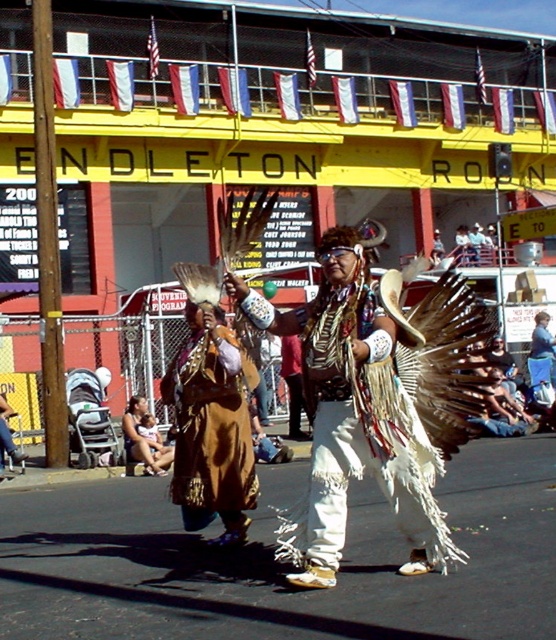
Can you confirm if brown suede dress at center is thinner than brown leather dress at lower left?

Correct, brown suede dress at center's width is less than brown leather dress at lower left's.

Is brown suede dress at center to the right of brown leather dress at lower left from the viewer's perspective?

Indeed, brown suede dress at center is positioned on the right side of brown leather dress at lower left.

Is point (188, 365) farther from viewer compared to point (140, 401)?

No, it is not.

I want to click on brown suede dress at center, so click(x=211, y=426).

Does white fringed feathers at center appear over brown leather dress at lower left?

Indeed, white fringed feathers at center is positioned over brown leather dress at lower left.

Can you confirm if white fringed feathers at center is wider than brown leather dress at lower left?

Yes, white fringed feathers at center is wider than brown leather dress at lower left.

Is point (314, 528) closer to camera compared to point (151, 417)?

Yes, it is.

What are the coordinates of `white fringed feathers at center` in the screenshot? It's located at (369, 444).

Between brown leather dress at lower left and brown feathered headdress at center, which one is positioned lower?

brown leather dress at lower left is lower down.

Identify the location of brown leather dress at lower left. [x=145, y=438].

You are a GUI agent. You are given a task and a screenshot of the screen. Output one action in this format:
    pyautogui.click(x=<x>, y=<y>)
    Task: Click on the brown leather dress at lower left
    The image size is (556, 640).
    Given the screenshot: What is the action you would take?
    pyautogui.click(x=145, y=438)